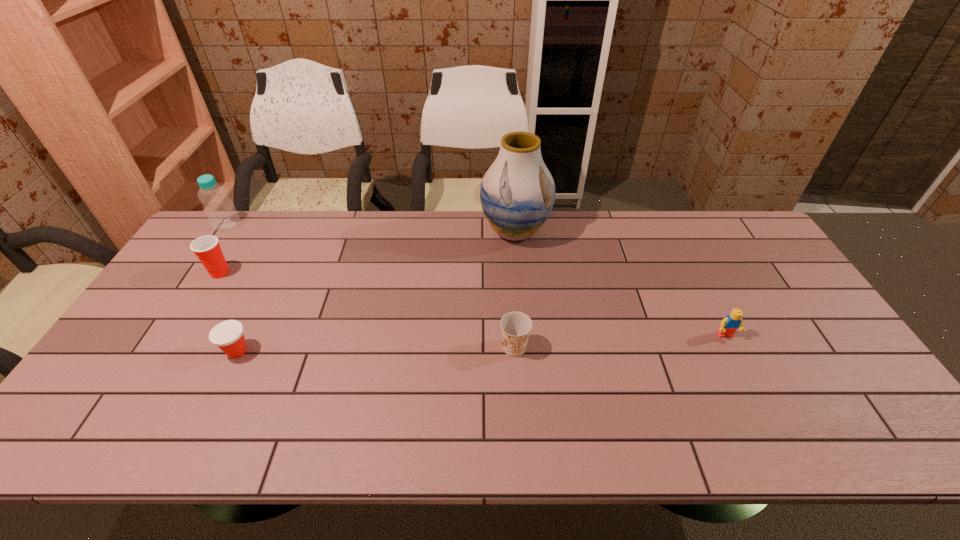
Identify the location of vacant region that satisfies the following two spatial constraints: 1. on the front side of the fourth object from right to left; 2. on the left side of the second tallest object. The height and width of the screenshot is (540, 960). (143, 351).